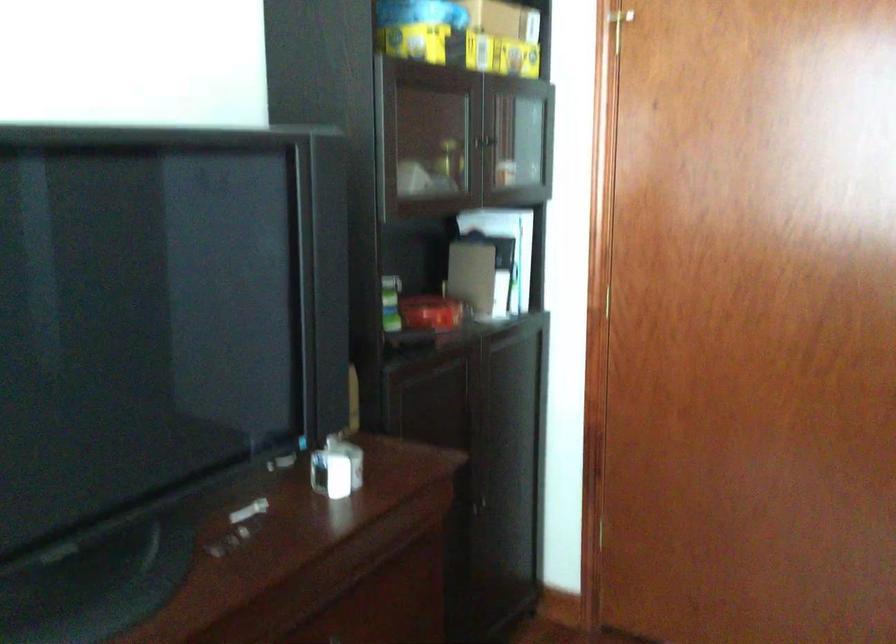
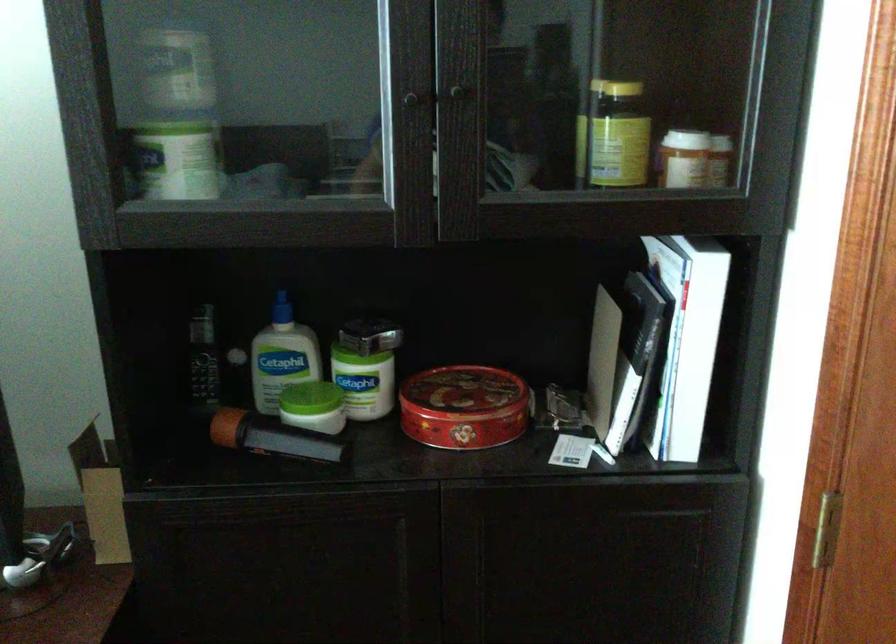
Locate, in the second image, the point that corresponds to [391,335] in the first image.

(268, 436)